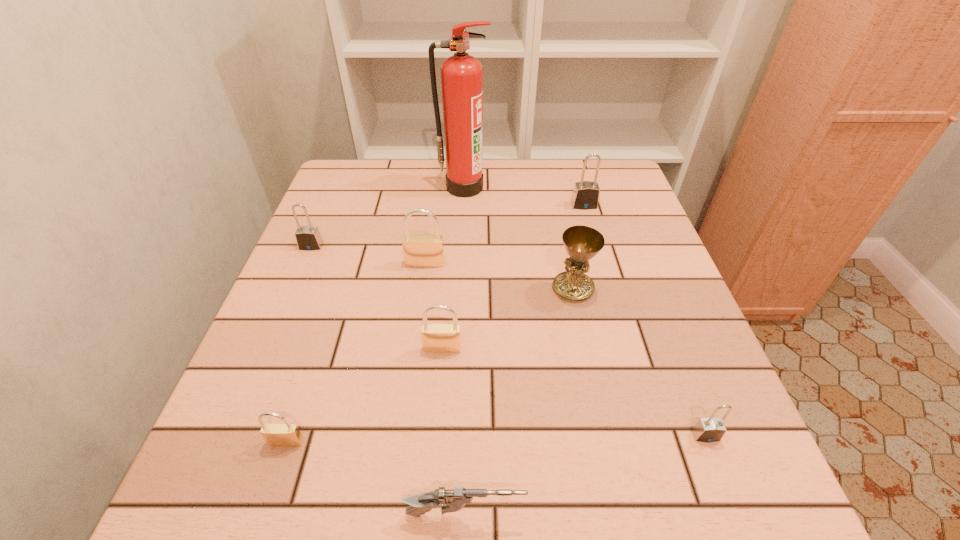
This screenshot has width=960, height=540. Find the location of `blank space at the near edge of the desktop`. blank space at the near edge of the desktop is located at coordinates (507, 480).

Identify the location of free space at the left edge of the desktop. This screenshot has width=960, height=540. (299, 261).

Locate an element on the screen. The width and height of the screenshot is (960, 540). free region at the right edge of the desktop is located at coordinates (614, 237).

I want to click on blank region between the farthest brass padlock and the nearest object, so click(x=445, y=389).

Locate an element on the screen. Image resolution: width=960 pixels, height=540 pixels. vacant region between the leftmost padlock and the nearest gray padlock is located at coordinates (509, 341).

Locate an element on the screen. This screenshot has height=540, width=960. free spot between the farthest padlock and the third nearest padlock is located at coordinates (514, 277).

What are the coordinates of `vacant region between the nearest object and the third farthest padlock` in the screenshot? It's located at (445, 389).

What are the coordinates of `empty space between the fifth nearest object and the farthest brass padlock` in the screenshot? It's located at (499, 276).

The width and height of the screenshot is (960, 540). In order to click on free spot between the gun and the farthest padlock in this screenshot , I will do `click(524, 360)`.

Identify the location of empty space between the second gray padlock from left to right and the fourth farthest padlock. This screenshot has height=540, width=960. (514, 277).